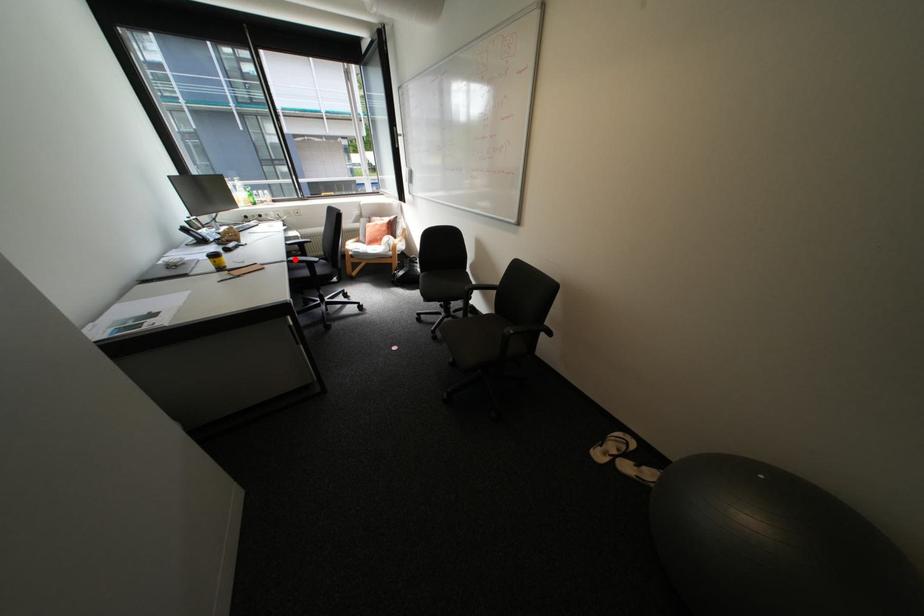
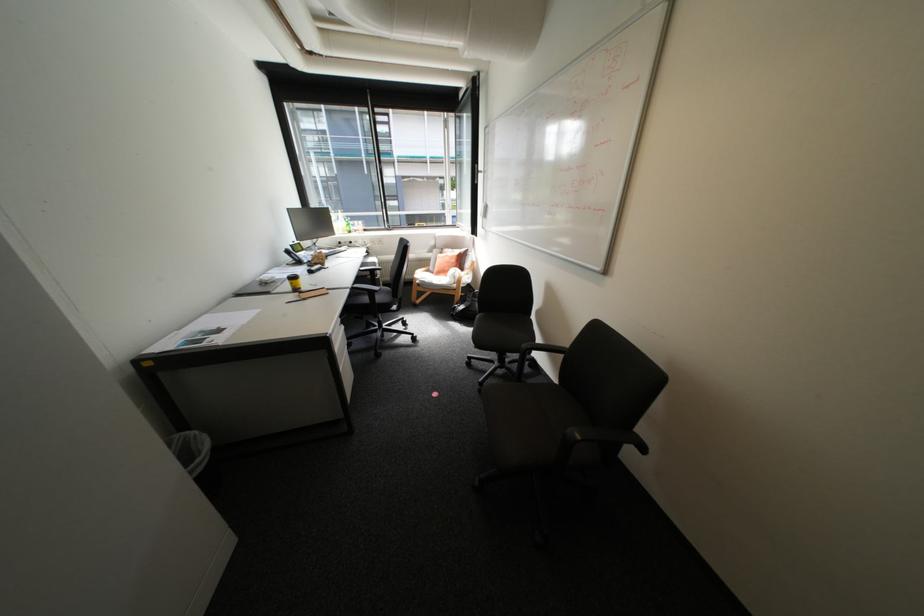
Question: I am providing you with two images of the same scene from different viewpoints. Image1 has a red point marked. In image2, the corresponding 3D location appears at what relative position? Reply with the corresponding letter.

Choices:
 (A) Closer
 (B) Farther

Answer: (B)